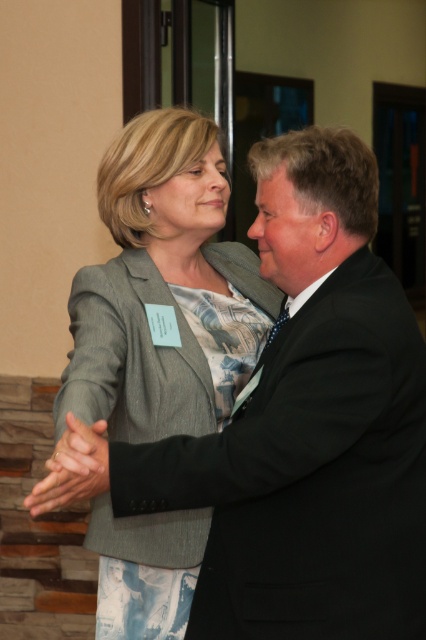
Question: Which point is farther from the camera taking this photo?

Choices:
 (A) (114, 349)
 (B) (330, 445)

Answer: (A)

Question: Can you confirm if black satin business suit at center is bigger than gray textured blazer at center?

Choices:
 (A) yes
 (B) no

Answer: (B)

Question: Is black satin business suit at center positioned before gray textured blazer at center?

Choices:
 (A) yes
 (B) no

Answer: (A)

Question: Which point is farther to the camera?

Choices:
 (A) gray textured blazer at center
 (B) black satin business suit at center

Answer: (A)

Question: Among these points, which one is nearest to the camera?

Choices:
 (A) (203, 328)
 (B) (284, 627)

Answer: (B)

Question: Does black satin business suit at center appear on the right side of gray textured blazer at center?

Choices:
 (A) yes
 (B) no

Answer: (A)